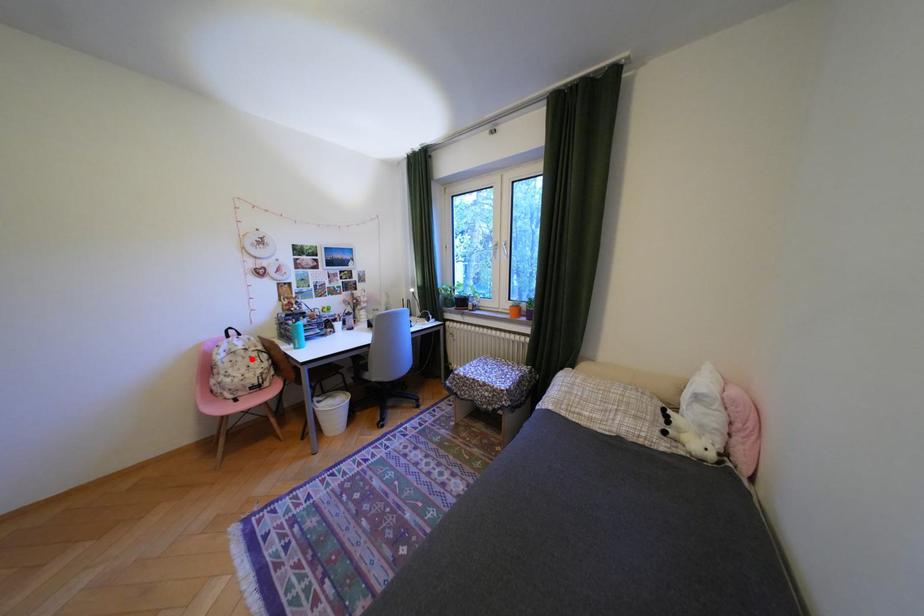
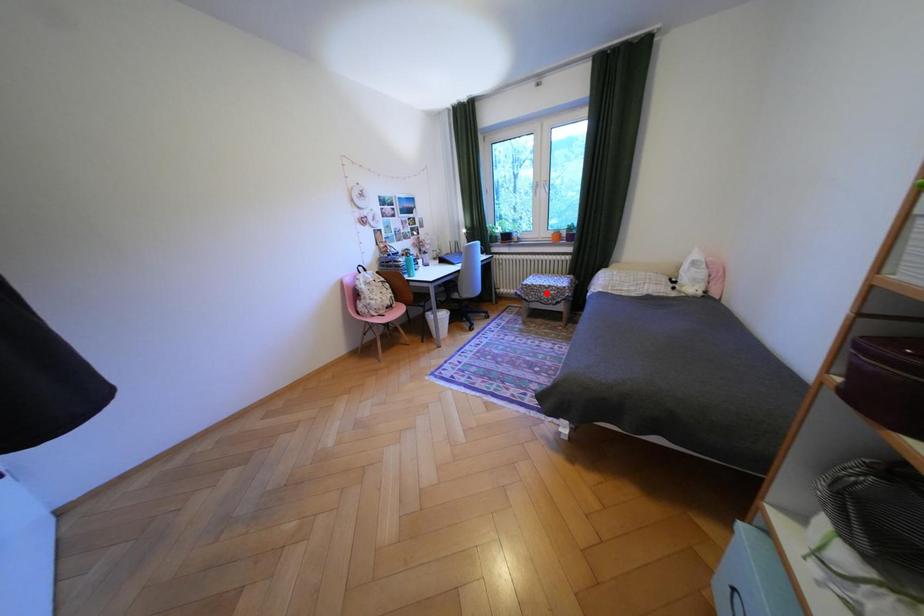
I am providing you with two images of the same scene from different viewpoints. A red point is marked on the first image and another point is marked on the second image. Are the points marked in image1 and image2 representing the same 3D position?

No